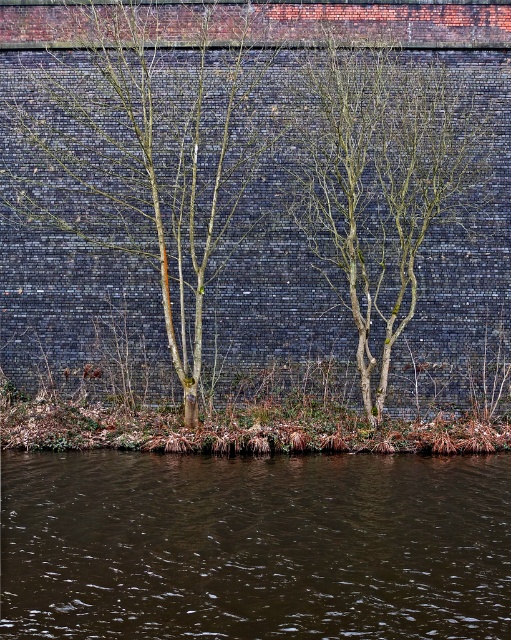
Which is behind, point (67, 564) or point (357, 330)?

Positioned behind is point (357, 330).

Is point (507, 531) positioned in front of point (336, 253)?

Yes.

Between point (276, 525) and point (379, 218), which one is positioned behind?

Point (379, 218)

Where is `brown liquid water at lower center`? brown liquid water at lower center is located at coordinates (253, 547).

Can you confirm if brown liquid water at lower center is bigger than bare wood tree at center?

Yes, brown liquid water at lower center is bigger than bare wood tree at center.

Based on the photo, between brown liquid water at lower center and bare wood tree at center, which one has less height?

With less height is brown liquid water at lower center.

Where is `brown liquid water at lower center`? Image resolution: width=511 pixels, height=640 pixels. brown liquid water at lower center is located at coordinates (253, 547).

Where is `brown liquid water at lower center`? brown liquid water at lower center is located at coordinates (253, 547).

Who is shorter, bare wood tree at center or bare branches at center?

With less height is bare wood tree at center.

Is point (239, 192) positioned before point (373, 284)?

No, it is not.

This screenshot has width=511, height=640. Find the location of `bare wood tree at center`. bare wood tree at center is located at coordinates (144, 157).